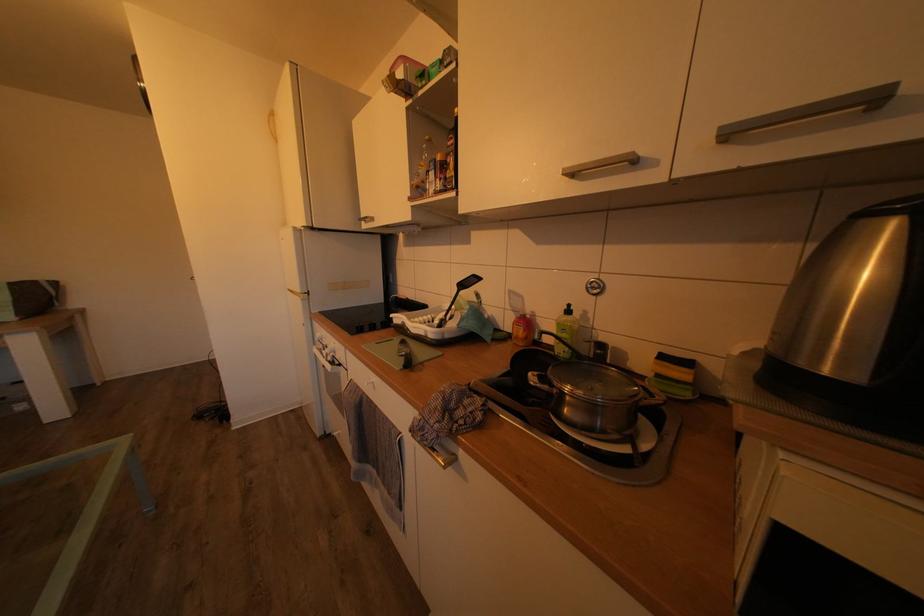
Locate an element on the screen. gold cabinet handle is located at coordinates (601, 164).